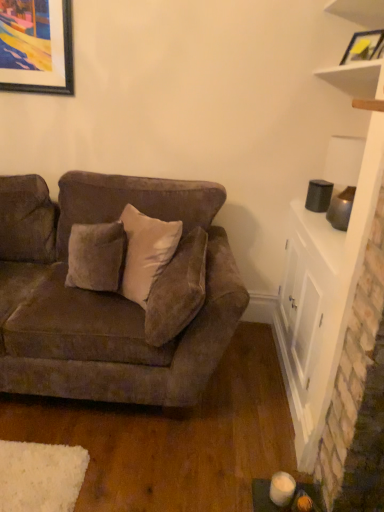
At what (x,y) coordinates should I click in order to perform the action: click on suede-like beige pillow at center. Please return your answer as a coordinate pair (x, y). Looking at the image, I should click on (177, 290).

Is suede brown couch at center located within white matte shelf at upper right?

No, suede brown couch at center is not inside white matte shelf at upper right.

Between point (352, 0) and point (104, 310), which one is positioned behind?

Point (352, 0)

From a real-world perspective, which object rests below the other?

suede brown couch at center is physically lower.

Based on the photo, can you confirm if white matte shelf at upper right is positioned to the right of suede brown couch at center?

Yes.

Is white glossy cabinet at right outside of matte yellow picture frame at upper right?

That's correct, white glossy cabinet at right is outside of matte yellow picture frame at upper right.

Considering the sizes of objects white glossy cabinet at right and matte yellow picture frame at upper right in the image provided, who is taller, white glossy cabinet at right or matte yellow picture frame at upper right?

Standing taller between the two is white glossy cabinet at right.

Would you say white glossy cabinet at right is to the left or to the right of matte yellow picture frame at upper right in the picture?

white glossy cabinet at right is positioned on matte yellow picture frame at upper right's left side.

Can you confirm if white glossy cabinet at right is smaller than matte yellow picture frame at upper right?

Actually, white glossy cabinet at right might be larger than matte yellow picture frame at upper right.

Is suede brown couch at center positioned with its back to white glossy cabinet at right?

No, suede brown couch at center is not facing the opposite direction of white glossy cabinet at right.

Considering the relative sizes of suede brown couch at center and white glossy cabinet at right in the image provided, is suede brown couch at center taller than white glossy cabinet at right?

Indeed, suede brown couch at center has a greater height compared to white glossy cabinet at right.

What are the coordinates of `table below the suede brown couch at center (from the image's perspective)` in the screenshot? It's located at (310, 322).

Would you say suede brown couch at center is outside white glossy cabinet at right?

That's correct, suede brown couch at center is outside of white glossy cabinet at right.

Considering the relative sizes of matte yellow picture frame at upper right and suede brown couch at center in the image provided, is matte yellow picture frame at upper right smaller than suede brown couch at center?

Yes.

Locate an element on the screen. The width and height of the screenshot is (384, 512). studio couch that is in front of the matte yellow picture frame at upper right is located at coordinates (105, 295).

How far apart are matte yellow picture frame at upper right and suede brown couch at center?

matte yellow picture frame at upper right and suede brown couch at center are 4.89 feet apart from each other.

From the image's perspective, is matte yellow picture frame at upper right positioned above or below suede brown couch at center?

Clearly, from the image's perspective, matte yellow picture frame at upper right is above suede brown couch at center.

Is suede brown couch at center positioned beyond the bounds of matte yellow picture frame at upper right?

Absolutely, suede brown couch at center is external to matte yellow picture frame at upper right.

Locate an element on the screen. The height and width of the screenshot is (512, 384). picture frame above the suede brown couch at center (from a real-world perspective) is located at coordinates (364, 46).

Which of these two, suede brown couch at center or matte yellow picture frame at upper right, is smaller?

With smaller size is matte yellow picture frame at upper right.

Based on the photo, how distant is suede brown couch at center from matte yellow picture frame at upper right?

suede brown couch at center is 4.89 feet from matte yellow picture frame at upper right.

Measure the distance from white glossy cabinet at right to white matte shelf at upper right.

A distance of 1.11 meters exists between white glossy cabinet at right and white matte shelf at upper right.

Is white glossy cabinet at right looking in the opposite direction of white matte shelf at upper right?

No, white glossy cabinet at right is not facing away from white matte shelf at upper right.

Looking at this image, is white glossy cabinet at right outside of white matte shelf at upper right?

Indeed, white glossy cabinet at right is completely outside white matte shelf at upper right.

Are matte yellow picture frame at upper right and white matte shelf at upper right located far from each other?

They are positioned close to each other.

Can you confirm if matte yellow picture frame at upper right is shorter than white matte shelf at upper right?

Yes, matte yellow picture frame at upper right is shorter than white matte shelf at upper right.

From a real-world perspective, is matte yellow picture frame at upper right positioned under white matte shelf at upper right based on gravity?

Yes, from a real-world perspective, matte yellow picture frame at upper right is below white matte shelf at upper right.

Is matte yellow picture frame at upper right positioned with its back to white matte shelf at upper right?

Yes.

Where is `shelf that appears on the right of suede brown couch at center`? This screenshot has height=512, width=384. shelf that appears on the right of suede brown couch at center is located at coordinates (357, 78).

Find the location of a particular element. table below the matte yellow picture frame at upper right (from a real-world perspective) is located at coordinates (310, 322).

Based on their spatial positions, is suede-like beige pillow at center or white matte shelf at upper right closer to suede brown couch at center?

suede-like beige pillow at center is positioned closer to the anchor suede brown couch at center.

Considering their positions, is white glossy cabinet at right positioned closer to white matte shelf at upper right than suede-like beige pillow at center?

white glossy cabinet at right lies closer to white matte shelf at upper right than the other object.

Considering their positions, is matte yellow picture frame at upper right positioned further to white matte shelf at upper right than suede-like beige pillow at center?

suede-like beige pillow at center lies further to white matte shelf at upper right than the other object.

From the image, which object appears to be farther from suede brown couch at center, matte yellow picture frame at upper right or suede-like beige pillow at center?

The object further to suede brown couch at center is matte yellow picture frame at upper right.

From the image, which object appears to be farther from suede-like beige pillow at center, white glossy cabinet at right or suede brown couch at center?

Among the two, white glossy cabinet at right is located further to suede-like beige pillow at center.

When comparing their distances from suede-like beige pillow at center, does white matte shelf at upper right or white glossy cabinet at right seem further?

white matte shelf at upper right lies further to suede-like beige pillow at center than the other object.

From the image, which object appears to be farther from suede brown couch at center, suede-like beige pillow at center or white glossy cabinet at right?

Among the two, white glossy cabinet at right is located further to suede brown couch at center.

Based on their spatial positions, is white glossy cabinet at right or suede-like beige pillow at center further from suede brown couch at center?

The object further to suede brown couch at center is white glossy cabinet at right.

Locate an element on the screen. The image size is (384, 512). table between suede brown couch at center and matte yellow picture frame at upper right from left to right is located at coordinates (310, 322).

At what (x,y) coordinates should I click in order to perform the action: click on pillow between white matte shelf at upper right and white glossy cabinet at right vertically. Please return your answer as a coordinate pair (x, y). This screenshot has width=384, height=512. Looking at the image, I should click on (177, 290).

Locate an element on the screen. Image resolution: width=384 pixels, height=512 pixels. table between suede brown couch at center and white matte shelf at upper right from left to right is located at coordinates (310, 322).

You are a GUI agent. You are given a task and a screenshot of the screen. Output one action in this format:
    pyautogui.click(x=<x>, y=<y>)
    Task: Click on the picture frame located between suede brown couch at center and white matte shelf at upper right in the left-right direction
    
    Given the screenshot: What is the action you would take?
    pyautogui.click(x=364, y=46)